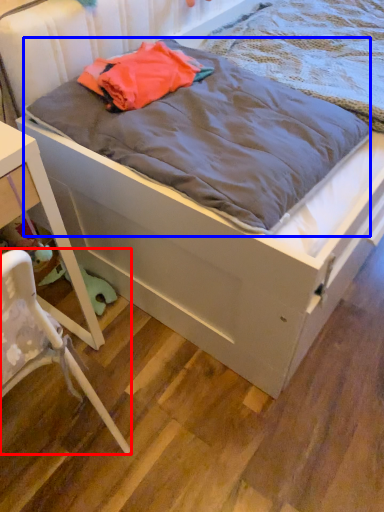
Question: Which point is closer to the camera, chair (highlighted by a red box) or blanket (highlighted by a blue box)?

Choices:
 (A) chair
 (B) blanket

Answer: (A)